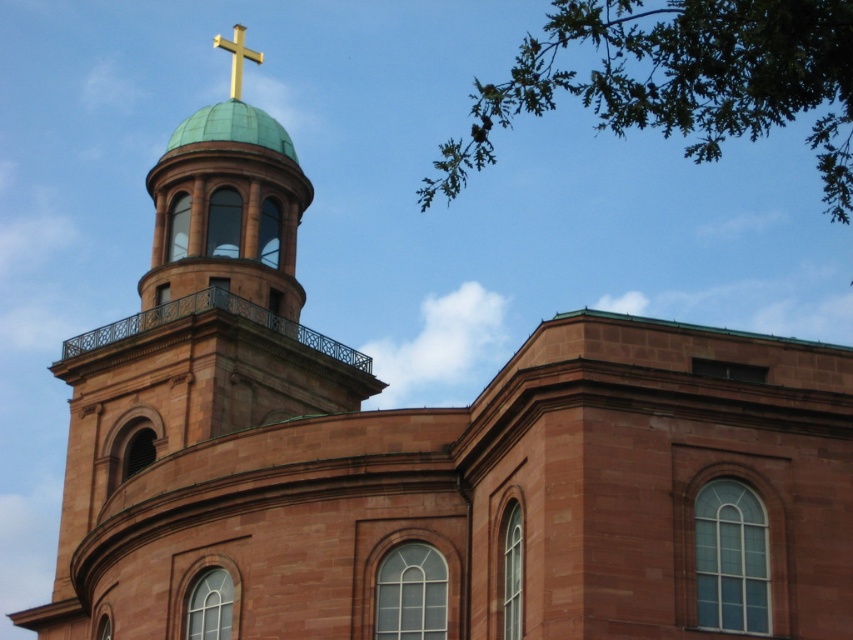
Question: Which of the following is the farthest from the observer?

Choices:
 (A) green leafy branch at upper right
 (B) gold metallic cross at top

Answer: (B)

Question: Does green leafy branch at upper right appear on the left side of gold metallic cross at top?

Choices:
 (A) yes
 (B) no

Answer: (B)

Question: Which object appears closest to the camera in this image?

Choices:
 (A) gold metallic cross at top
 (B) green leafy branch at upper right

Answer: (B)

Question: Does green leafy branch at upper right appear over gold metallic cross at top?

Choices:
 (A) no
 (B) yes

Answer: (A)

Question: Does green leafy branch at upper right appear over gold metallic cross at top?

Choices:
 (A) yes
 (B) no

Answer: (B)